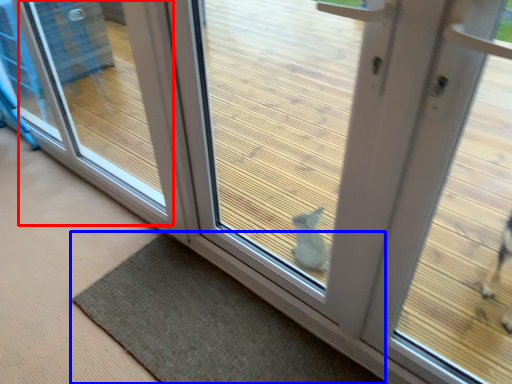
Question: Which object appears closest to the camera in this image, window (highlighted by a red box) or mat (highlighted by a blue box)?

Choices:
 (A) window
 (B) mat

Answer: (B)